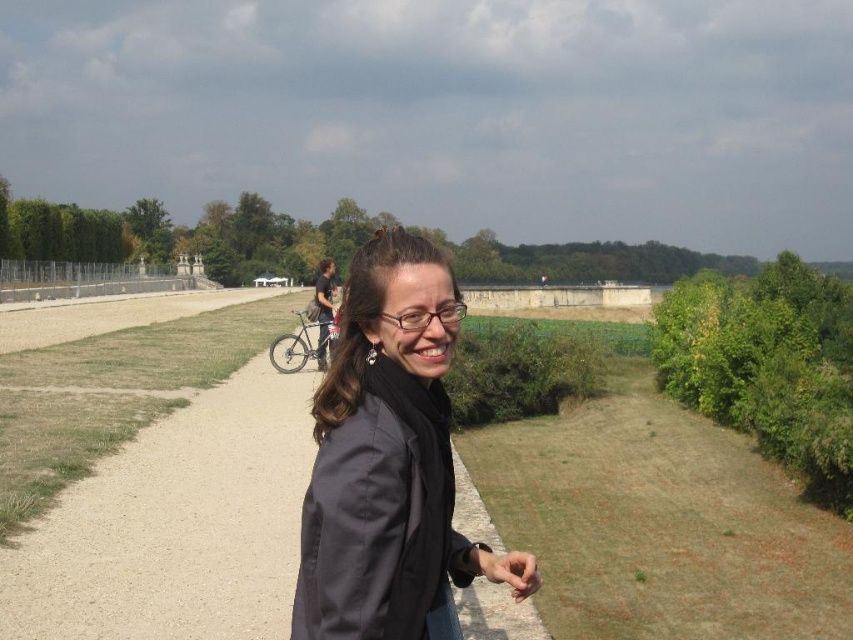
You are a pedestrian standing at the start of the smooth gravel path at center. You see the silver metallic bicycle at center parked nearby. Can you safely walk along the path without stepping on the bicycle?

The smooth gravel path at center is located above the silver metallic bicycle at center, so the path is elevated. You can safely walk along the smooth gravel path at center without stepping on the silver metallic bicycle at center.

You are a pedestrian standing on the smooth gravel path at center. You want to move to the dark gray jacket at center. Which direction should you move?

The smooth gravel path at center is to the left of the dark gray jacket at center, so you should move to the right to reach the dark gray jacket at center.

You are a delivery person who needs to ride your silver metallic bicycle at center along the smooth gravel path at center. Can you ride your bicycle on the path?

The smooth gravel path at center is taller than silver metallic bicycle at center, so the bicycle can be ridden on the path since the path is elevated enough to accommodate it.